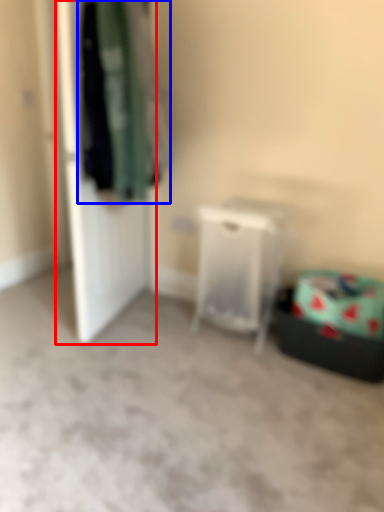
Question: Which point is closer to the camera, door (highlighted by a red box) or clothing (highlighted by a blue box)?

Choices:
 (A) door
 (B) clothing

Answer: (B)